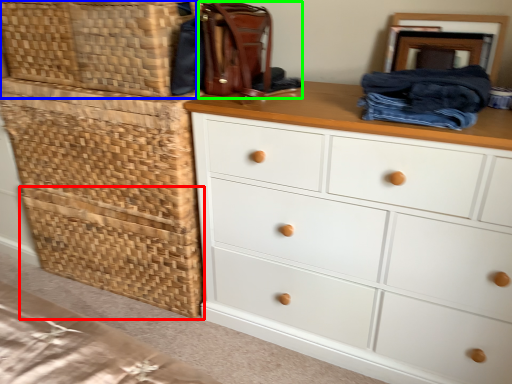
Question: Estimate the real-world distances between objects in this image. Which object is closer to basket (highlighted by a red box), basket (highlighted by a blue box) or handbag (highlighted by a green box)?

Choices:
 (A) basket
 (B) handbag

Answer: (A)